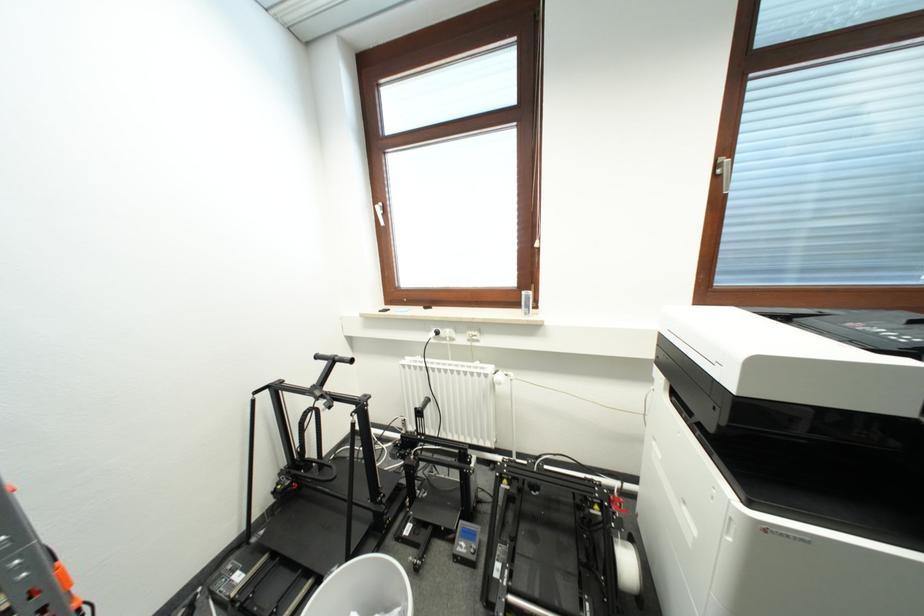
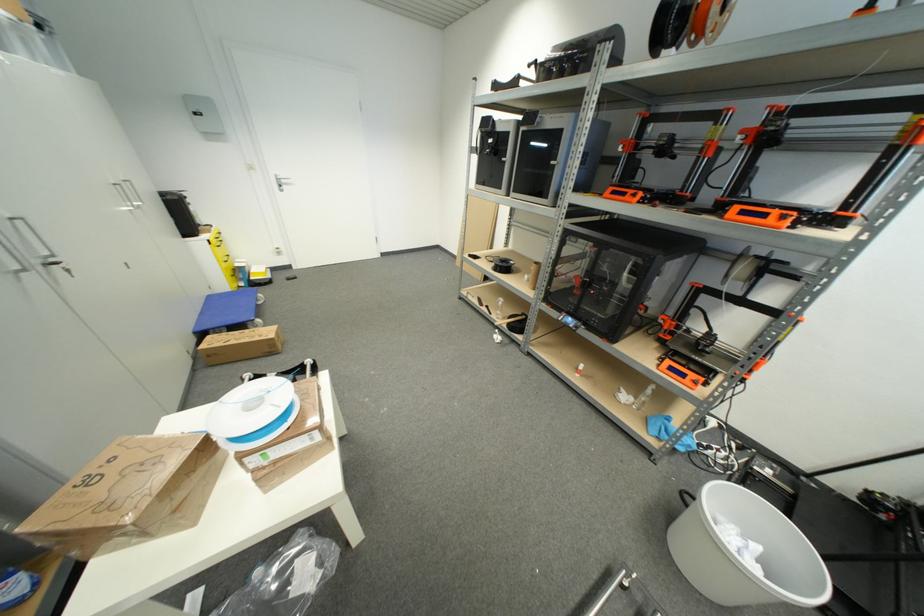
The point at (353, 560) is marked in the first image. Where is the corresponding point in the second image?

(821, 560)